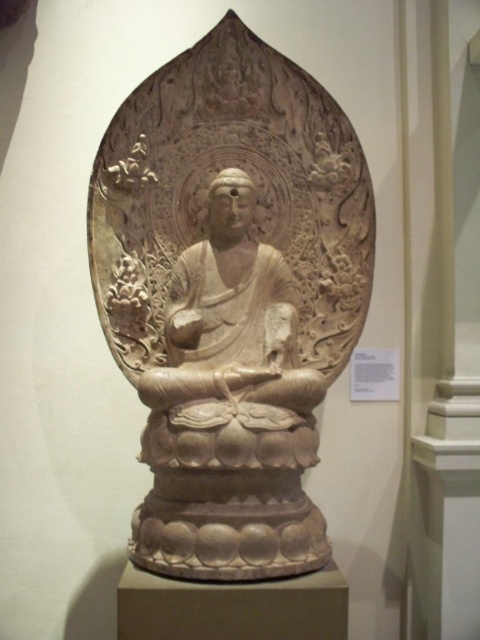
Question: Considering the relative positions of beige stone buddha at center and white stone statue at center in the image provided, where is beige stone buddha at center located with respect to white stone statue at center?

Choices:
 (A) left
 (B) right

Answer: (A)

Question: Which point appears closest to the camera in this image?

Choices:
 (A) (228, 346)
 (B) (90, 182)

Answer: (A)

Question: Observing the image, what is the correct spatial positioning of beige stone buddha at center in reference to white stone statue at center?

Choices:
 (A) right
 (B) left

Answer: (B)

Question: Which of the following is the closest to the observer?

Choices:
 (A) white stone statue at center
 (B) beige stone buddha at center

Answer: (A)

Question: Can you confirm if beige stone buddha at center is positioned to the left of white stone statue at center?

Choices:
 (A) no
 (B) yes

Answer: (B)